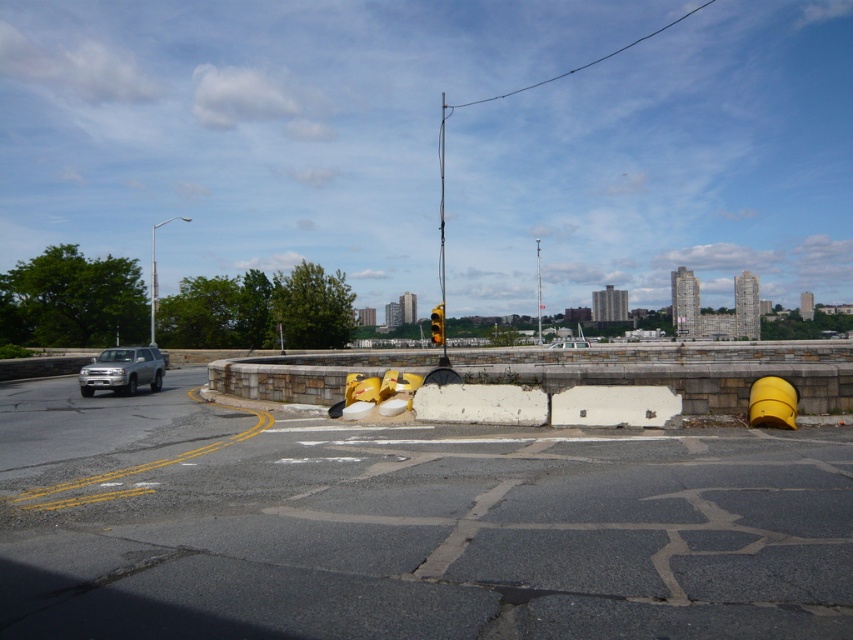
You are a pedestrian standing at the edge of the road and want to cross to the roundabout. You see the yellow rubber barrier at center and the metallic pole at center. Which object is closer to your current position?

The yellow rubber barrier at center is closer to your current position because it is to the left of the metallic pole at center, which is further away.

You are a pedestrian standing at the edge of the road. You see the yellow rubber barrier at center and the metallic pole at center. Which object is closer to you?

The yellow rubber barrier at center is closer to you because it is in front of the metallic pole at center.